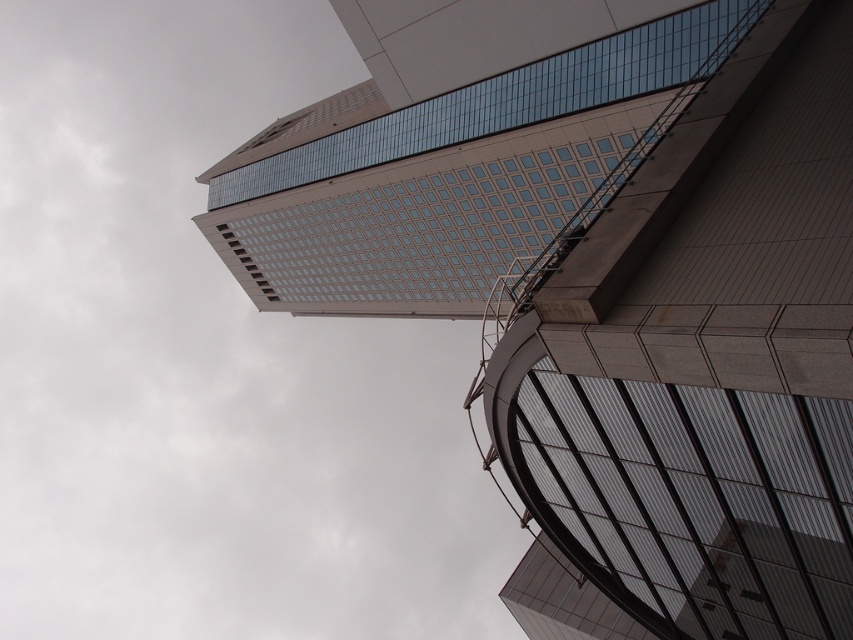
Question: Which of the following is the closest to the observer?

Choices:
 (A) smooth glass building at upper center
 (B) glassy reflective tower at upper center

Answer: (A)

Question: Which point is farther to the camera?

Choices:
 (A) (724, 349)
 (B) (393, 282)

Answer: (B)

Question: Is smooth glass building at upper center to the left of glassy reflective tower at upper center from the viewer's perspective?

Choices:
 (A) yes
 (B) no

Answer: (B)

Question: Can you confirm if smooth glass building at upper center is positioned to the left of glassy reflective tower at upper center?

Choices:
 (A) yes
 (B) no

Answer: (B)

Question: Which point is closer to the camera?

Choices:
 (A) glassy reflective tower at upper center
 (B) smooth glass building at upper center

Answer: (B)

Question: Can you confirm if smooth glass building at upper center is positioned to the right of glassy reflective tower at upper center?

Choices:
 (A) no
 (B) yes

Answer: (B)